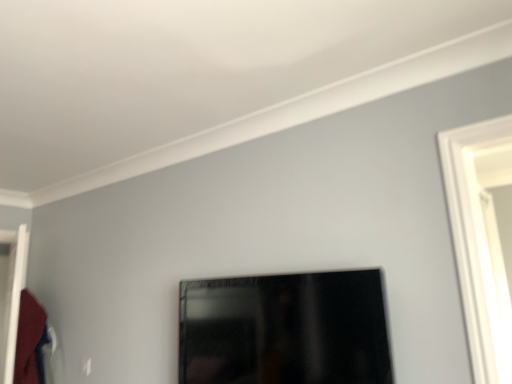
Question: Is white glossy door at left oriented towards matte black picture frame at center?

Choices:
 (A) no
 (B) yes

Answer: (A)

Question: Is white glossy door at left closer to camera compared to matte black picture frame at center?

Choices:
 (A) no
 (B) yes

Answer: (A)

Question: Can you confirm if white glossy door at left is smaller than matte black picture frame at center?

Choices:
 (A) yes
 (B) no

Answer: (B)

Question: Could matte black picture frame at center be considered to be inside white glossy door at left?

Choices:
 (A) no
 (B) yes

Answer: (A)

Question: From a real-world perspective, is white glossy door at left located beneath matte black picture frame at center?

Choices:
 (A) yes
 (B) no

Answer: (B)

Question: From the image's perspective, is white glossy door at left below matte black picture frame at center?

Choices:
 (A) no
 (B) yes

Answer: (B)

Question: Is matte black picture frame at center shorter than velvet red robe at left?

Choices:
 (A) no
 (B) yes

Answer: (B)

Question: Is matte black picture frame at center completely or partially outside of velvet red robe at left?

Choices:
 (A) yes
 (B) no

Answer: (A)

Question: Does matte black picture frame at center appear on the left side of velvet red robe at left?

Choices:
 (A) no
 (B) yes

Answer: (A)

Question: Could you tell me if matte black picture frame at center is facing velvet red robe at left?

Choices:
 (A) no
 (B) yes

Answer: (A)

Question: Can you confirm if matte black picture frame at center is bigger than velvet red robe at left?

Choices:
 (A) no
 (B) yes

Answer: (B)

Question: Considering the relative positions of matte black picture frame at center and velvet red robe at left in the image provided, is matte black picture frame at center to the right of velvet red robe at left from the viewer's perspective?

Choices:
 (A) yes
 (B) no

Answer: (A)

Question: Does velvet red robe at left come behind white glossy door at left?

Choices:
 (A) yes
 (B) no

Answer: (A)